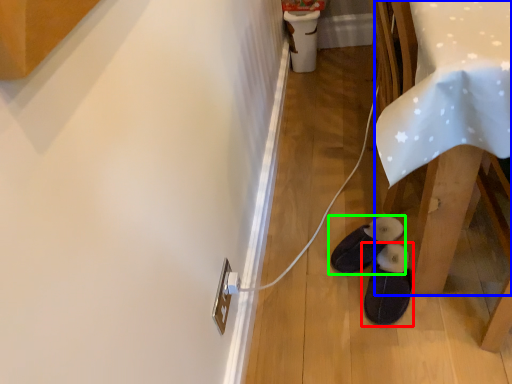
Question: Considering the real-world distances, which object is closest to footwear (highlighted by a red box)? table (highlighted by a blue box) or footwear (highlighted by a green box).

Choices:
 (A) table
 (B) footwear

Answer: (B)